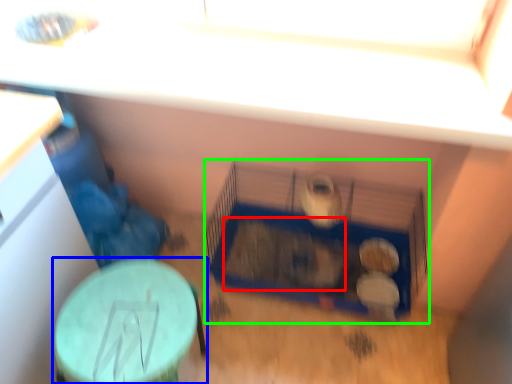
Question: Which object is the farthest from animal (highlighted by a red box)? Choose among these: table (highlighted by a blue box) or bird cage (highlighted by a green box).

Choices:
 (A) table
 (B) bird cage

Answer: (A)